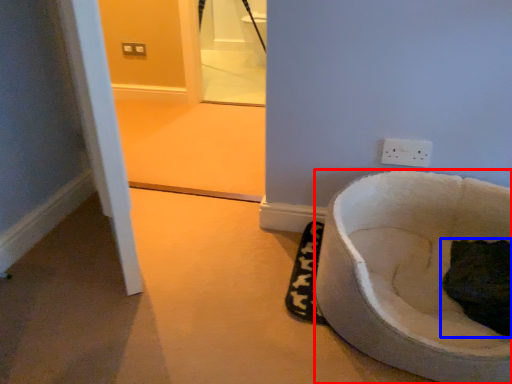
Question: Which object is closer to the camera taking this photo, toilet (highlighted by a red box) or cat (highlighted by a blue box)?

Choices:
 (A) toilet
 (B) cat

Answer: (A)